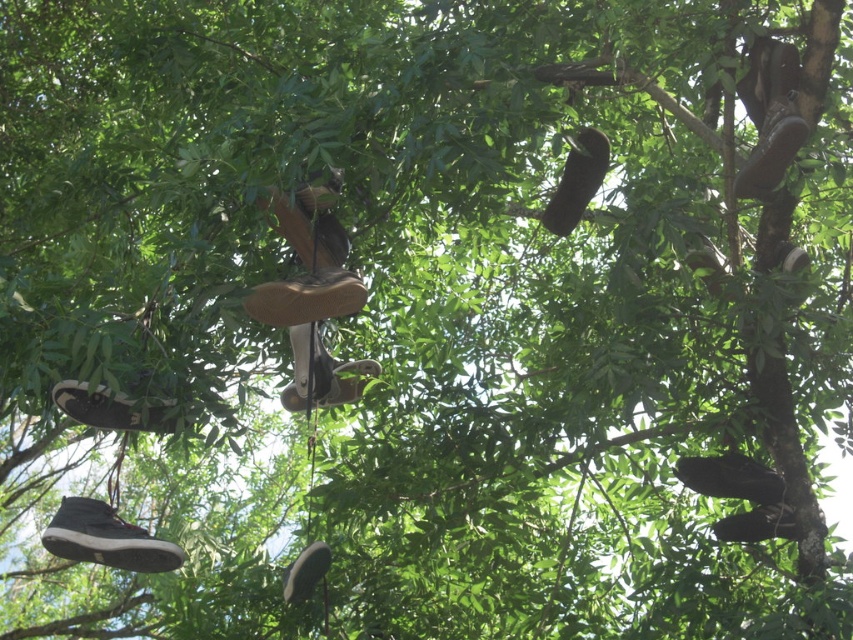
Question: Considering the relative positions of black suede shoe at lower left and camouflage fabric shoe at lower left in the image provided, where is black suede shoe at lower left located with respect to camouflage fabric shoe at lower left?

Choices:
 (A) above
 (B) below

Answer: (B)

Question: Is leather shoe at center positioned before matte brown shoe at center?

Choices:
 (A) no
 (B) yes

Answer: (B)

Question: Which of the following is the closest to the observer?

Choices:
 (A) brown suede shoe at upper right
 (B) leather shoe at center
 (C) camouflage fabric shoe at lower left

Answer: (C)

Question: Can you confirm if leather shoe at center is positioned to the left of matte brown shoe at center?

Choices:
 (A) yes
 (B) no

Answer: (B)

Question: Which point is farther to the camera?

Choices:
 (A) (563, 179)
 (B) (788, 124)
 (C) (347, 289)

Answer: (A)

Question: Among these points, which one is nearest to the camera?

Choices:
 (A) (125, 420)
 (B) (308, 589)
 (C) (331, 381)

Answer: (A)